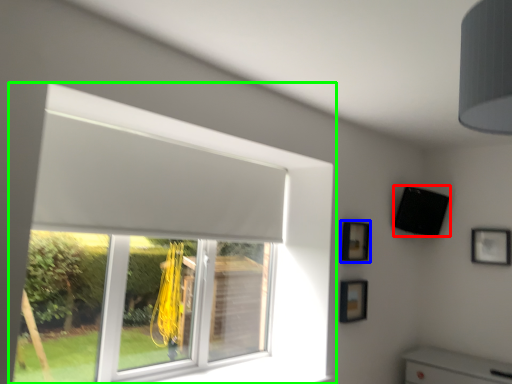
Question: Based on their relative distances, which object is farther from speaker (highlighted by a red box)? Choose from picture frame (highlighted by a blue box) and window (highlighted by a green box).

Choices:
 (A) picture frame
 (B) window

Answer: (B)